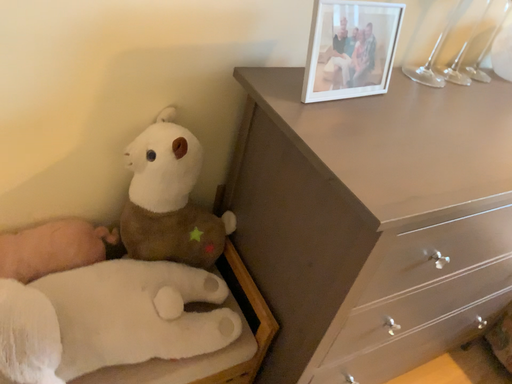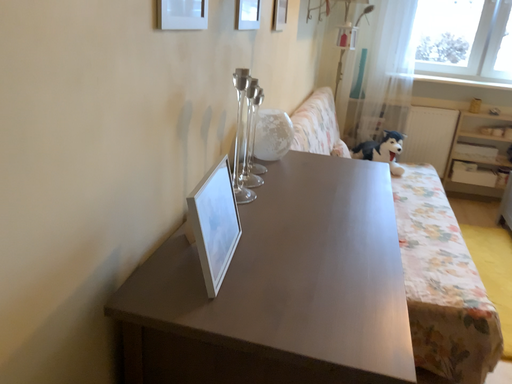
Question: Which way did the camera rotate in the video?

Choices:
 (A) rotated left
 (B) rotated right

Answer: (B)